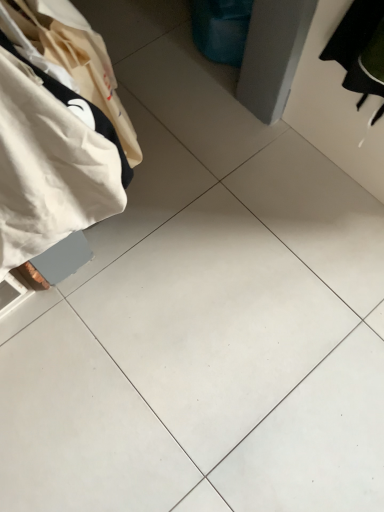
Locate an element on the screen. This screenshot has width=384, height=512. white fabric bag at left is located at coordinates (57, 129).

In the scene shown: Measure the distance between point (58, 57) and camera.

The depth of point (58, 57) is 27.83 inches.

In order to face white fabric bag at left, should I rotate leftwards or rightwards?

A 20.890 degree turn to the left will do.

What do you see at coordinates (57, 129) in the screenshot? I see `white fabric bag at left` at bounding box center [57, 129].

This screenshot has height=512, width=384. I want to click on white fabric bag at left, so click(x=57, y=129).